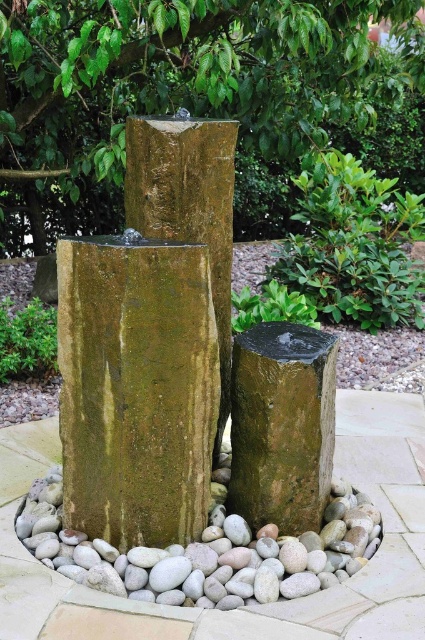
Based on the photo, between green mossy stone at center and smooth gray stones at center, which one is positioned higher?

green mossy stone at center

Is point (130, 122) less distant than point (350, 524)?

Yes, point (130, 122) is in front of point (350, 524).

In order to click on green mossy stone at center in this screenshot , I will do `click(150, 340)`.

Is point (149, 128) positioned behind point (0, 324)?

No, it is in front of (0, 324).

Locate an element on the screen. This screenshot has width=425, height=640. green mossy stone at center is located at coordinates (150, 340).

Measure the distance between green mossy stone at center and camera.

green mossy stone at center and camera are 9.26 feet apart from each other.

You are a GUI agent. You are given a task and a screenshot of the screen. Output one action in this format:
    pyautogui.click(x=<x>, y=<y>)
    Task: Click on the green mossy stone at center
    This screenshot has height=640, width=425.
    Given the screenshot: What is the action you would take?
    pyautogui.click(x=150, y=340)

Does smooth gray stones at center have a greater height compared to green mossy rock at lower left?

Incorrect, smooth gray stones at center's height is not larger of green mossy rock at lower left's.

Is point (376, 516) less distant than point (36, 358)?

Yes, point (376, 516) is in front of point (36, 358).

This screenshot has width=425, height=640. Identify the location of smooth gray stones at center. (207, 554).

The image size is (425, 640). Find the location of `smooth gray stones at center`. smooth gray stones at center is located at coordinates (207, 554).